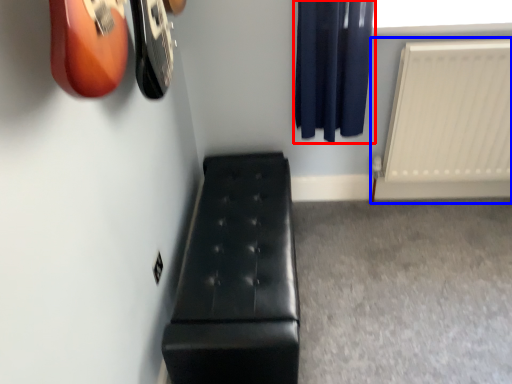
Question: Which of the following is the closest to the observer, curtain (highlighted by a red box) or radiator (highlighted by a blue box)?

Choices:
 (A) curtain
 (B) radiator

Answer: (A)